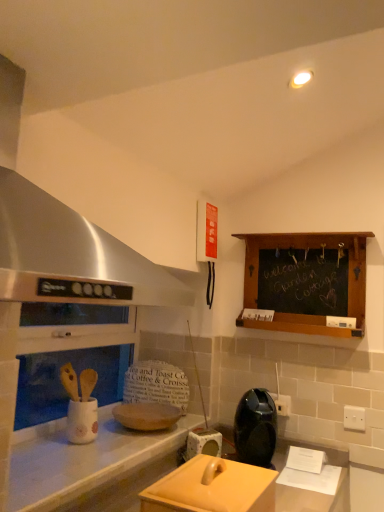
Question: From a real-world perspective, is white plastic electric outlet at upper right, the 2th electric outlet in the left-to-right sequence, positioned above or below matte beige toaster at center, arranged as the 1th appliance when viewed from the back?

Choices:
 (A) below
 (B) above

Answer: (B)

Question: Is white plastic electric outlet at upper right, the first electric outlet from the right, in front of or behind matte beige toaster at center, arranged as the 1th appliance when viewed from the back, in the image?

Choices:
 (A) behind
 (B) front

Answer: (A)

Question: Considering the real-world distances, which object is farthest from the matte beige toaster at center, positioned as the 3th appliance in front-to-back order?

Choices:
 (A) black glossy coffee maker at center, which is counted as the 2th appliance, starting from the back
 (B) black plastic electric outlet at center-right, the first electric outlet in the back-to-front sequence
 (C) chalkboard wood at upper right
 (D) white plastic electric outlet at upper right, the first electric outlet from the right
 (E) matte yellow lid at center, the 3th appliance when ordered from back to front

Answer: (C)

Question: Which object is the farthest from the matte beige toaster at center, positioned as the 3th appliance in front-to-back order?

Choices:
 (A) black plastic electric outlet at center-right, which appears as the second electric outlet when viewed from the right
 (B) white plastic electric outlet at upper right, which ranks as the 1th electric outlet in front-to-back order
 (C) chalkboard wood at upper right
 (D) stainless steel exhaust hood at upper left
 (E) matte yellow lid at center, which is the first appliance in front-to-back order

Answer: (D)